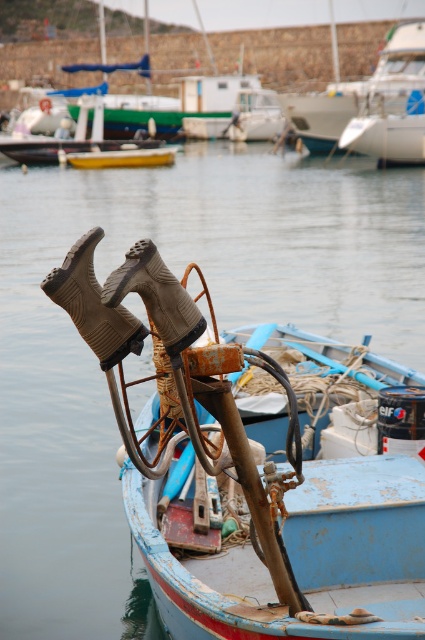
You are standing at the point labeled as point [294,508]. What object are you currently standing on?

You are standing on the rusty metal boat at center, which is represented by point [294,508].